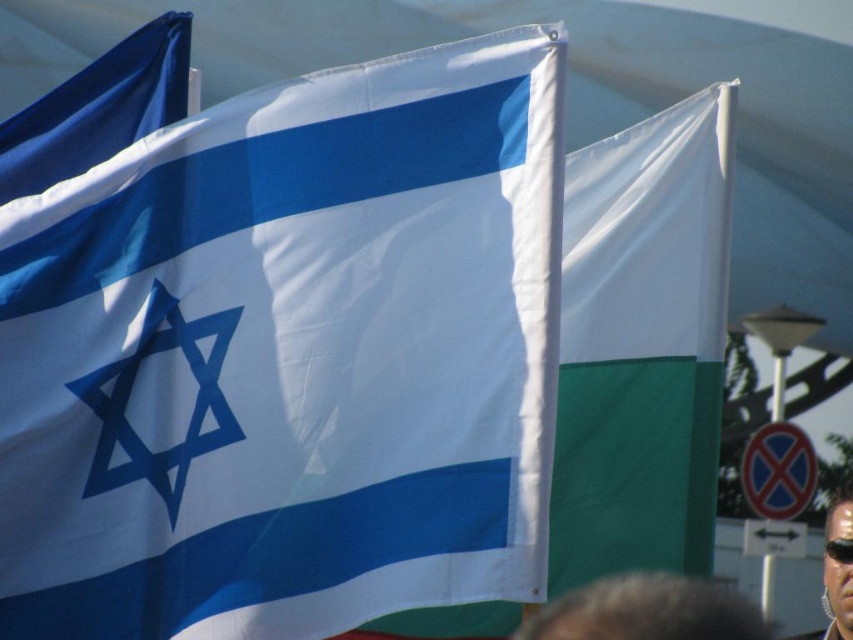
What do you see at coordinates (289, 356) in the screenshot? The width and height of the screenshot is (853, 640). I see `blue fabric flag at center` at bounding box center [289, 356].

Does blue fabric flag at center have a lesser height compared to blue fabric flag at upper left?

Indeed, blue fabric flag at center has a lesser height compared to blue fabric flag at upper left.

Does point (294, 388) come farther from viewer compared to point (157, 42)?

No, it is in front of (157, 42).

Find the location of `blue fabric flag at center`. blue fabric flag at center is located at coordinates (289, 356).

Between blue fabric flag at upper left and transparent plastic goggles at lower right, which one has more height?

blue fabric flag at upper left is taller.

Does point (80, 129) come farther from viewer compared to point (846, 552)?

That is False.

Which is in front, point (70, 108) or point (840, 540)?

Point (70, 108)

The image size is (853, 640). I want to click on blue fabric flag at upper left, so click(x=97, y=108).

Who is taller, sunglasses at upper right or transparent plastic goggles at lower right?

sunglasses at upper right

Is sunglasses at upper right wider than transparent plastic goggles at lower right?

Correct, the width of sunglasses at upper right exceeds that of transparent plastic goggles at lower right.

Describe the element at coordinates (836, 568) in the screenshot. The height and width of the screenshot is (640, 853). I see `sunglasses at upper right` at that location.

Image resolution: width=853 pixels, height=640 pixels. I want to click on sunglasses at upper right, so click(x=836, y=568).